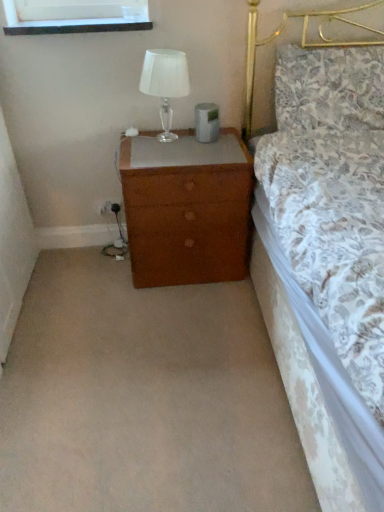
Question: Would you consider brown wood nightstand at lower center to be distant from floral fabric pillow at upper right?

Choices:
 (A) no
 (B) yes

Answer: (B)

Question: Can you confirm if brown wood nightstand at lower center is taller than floral fabric pillow at upper right?

Choices:
 (A) no
 (B) yes

Answer: (A)

Question: From the image's perspective, does brown wood nightstand at lower center appear higher than floral fabric pillow at upper right?

Choices:
 (A) no
 (B) yes

Answer: (A)

Question: Is brown wood nightstand at lower center further to camera compared to floral fabric pillow at upper right?

Choices:
 (A) yes
 (B) no

Answer: (B)

Question: Does brown wood nightstand at lower center have a larger size compared to floral fabric pillow at upper right?

Choices:
 (A) no
 (B) yes

Answer: (B)

Question: Can you confirm if brown wood nightstand at lower center is thinner than floral fabric pillow at upper right?

Choices:
 (A) no
 (B) yes

Answer: (A)

Question: Considering the relative positions of brown wood nightstand at lower center and brown wood chest of drawers at center in the image provided, is brown wood nightstand at lower center to the left of brown wood chest of drawers at center from the viewer's perspective?

Choices:
 (A) no
 (B) yes

Answer: (B)

Question: Is brown wood nightstand at lower center oriented away from brown wood chest of drawers at center?

Choices:
 (A) yes
 (B) no

Answer: (A)

Question: Does brown wood nightstand at lower center lie in front of brown wood chest of drawers at center?

Choices:
 (A) no
 (B) yes

Answer: (B)

Question: Is brown wood nightstand at lower center wider than brown wood chest of drawers at center?

Choices:
 (A) yes
 (B) no

Answer: (A)

Question: Does brown wood nightstand at lower center have a smaller size compared to brown wood chest of drawers at center?

Choices:
 (A) no
 (B) yes

Answer: (B)

Question: From a real-world perspective, is brown wood nightstand at lower center positioned over brown wood chest of drawers at center based on gravity?

Choices:
 (A) yes
 (B) no

Answer: (B)

Question: Considering the relative sizes of brown wood nightstand at lower center and clear glass table lamp at upper right in the image provided, is brown wood nightstand at lower center thinner than clear glass table lamp at upper right?

Choices:
 (A) no
 (B) yes

Answer: (A)